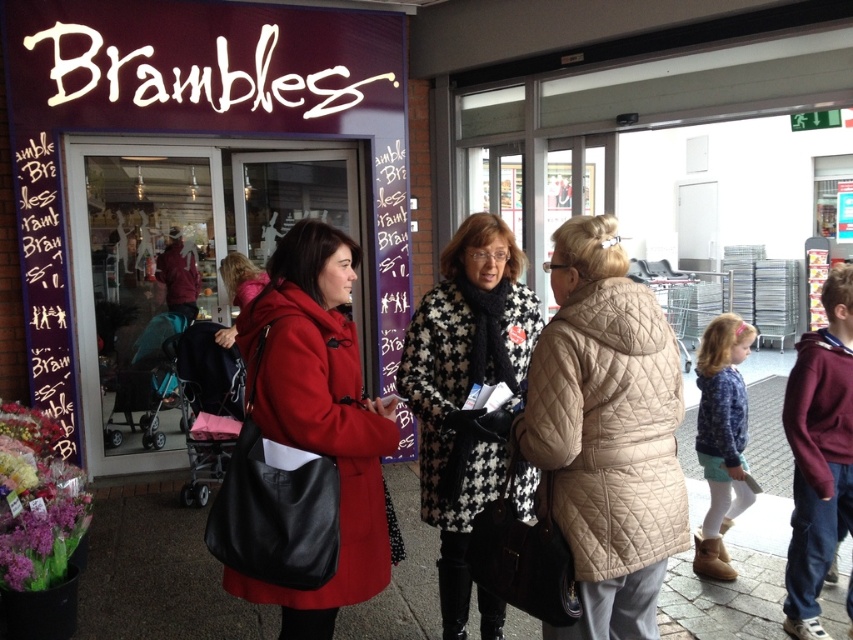
You are a photographer trying to capture a clear photo of the beige quilted coat at center without the matte black coat at center blocking it. What should you do?

The matte black coat at center is positioned over the beige quilted coat at center, so you should move your camera angle downward to avoid the obstruction.

You are a photographer trying to capture a group photo of the two women in coats outside the Brambles store. Since the matte black coat at center and the beige quilted coat at center are both in the frame, which coat should you focus on to ensure the entire group is in focus, considering their sizes?

The matte black coat at center is bigger than the beige quilted coat at center, so focusing on the matte black coat at center will help ensure the entire group is in focus as it occupies more space in the frame.